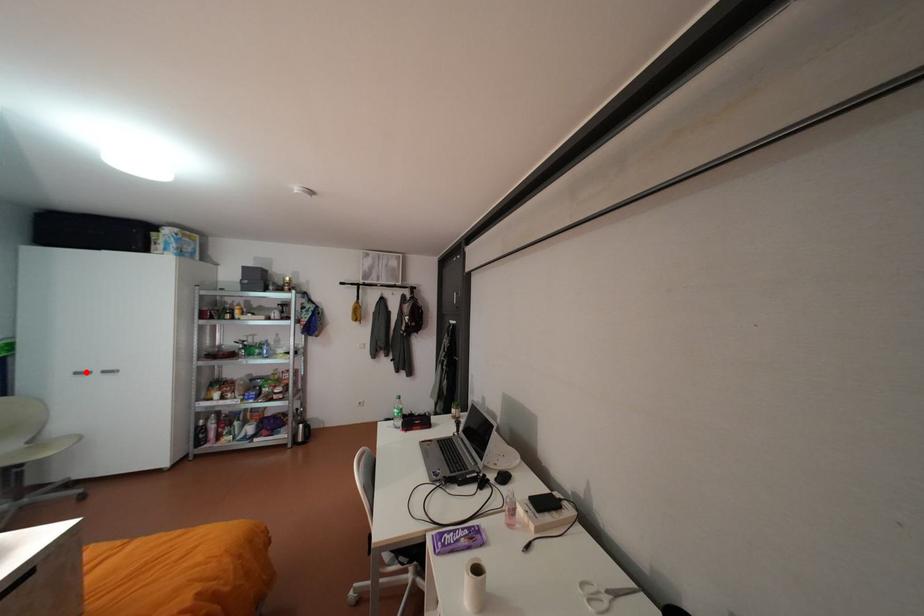
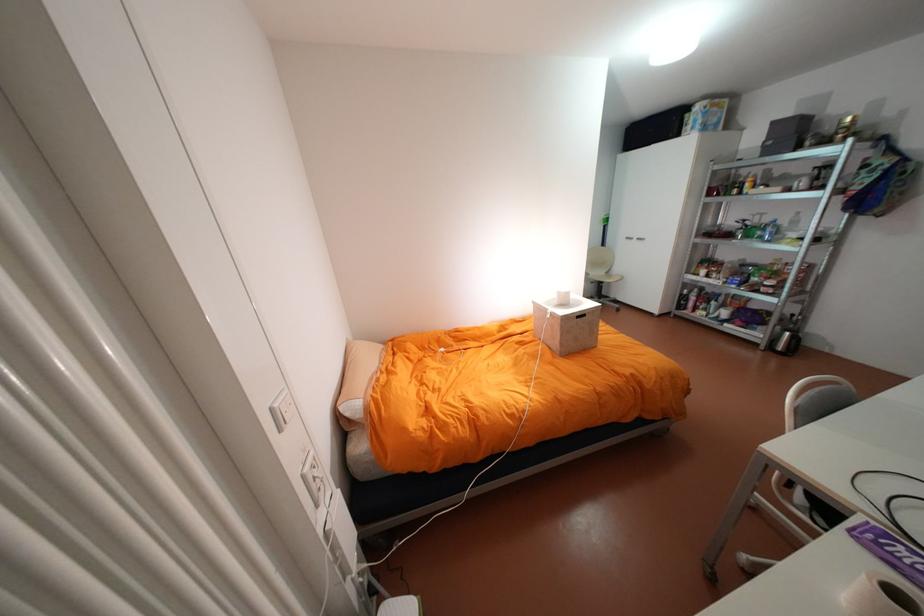
Locate, in the second image, the point that corresponds to the highlighted location in the first image.

(636, 237)